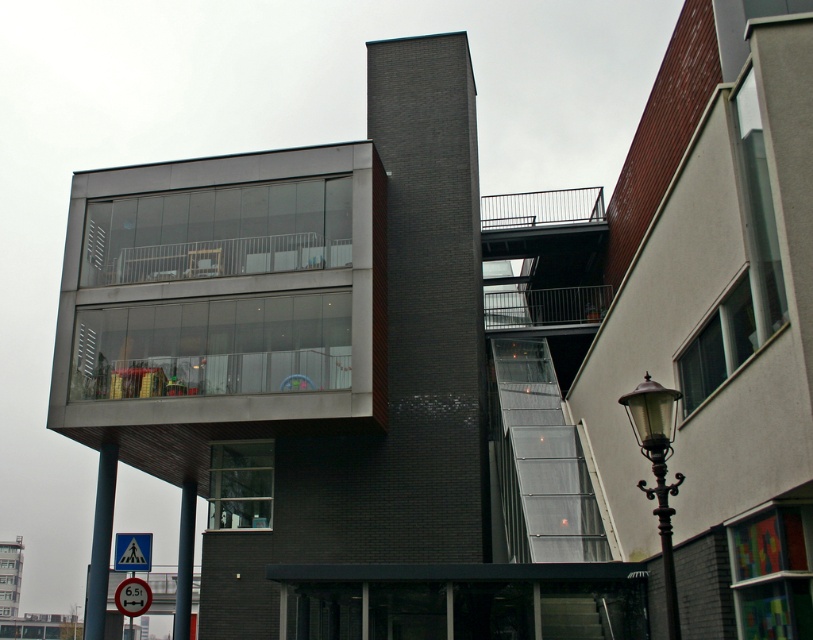
Question: Is black wrought iron streetlight at lower right behind red plastic speed limit sign at lower left?

Choices:
 (A) yes
 (B) no

Answer: (B)

Question: Which object appears closest to the camera in this image?

Choices:
 (A) metallic gray balcony at upper center
 (B) red plastic speed limit sign at lower left

Answer: (B)

Question: Does metallic gray balcony at upper center appear on the left side of red plastic speed limit sign at lower left?

Choices:
 (A) no
 (B) yes

Answer: (A)

Question: Which point is closer to the camera?

Choices:
 (A) (568, 291)
 (B) (146, 570)
 (C) (127, 612)

Answer: (C)

Question: From the image, what is the correct spatial relationship of metallic gray balcony at upper center in relation to yellow plastic triangle at lower left?

Choices:
 (A) right
 (B) left

Answer: (A)

Question: Which point appears farthest from the camera in this image?

Choices:
 (A) (672, 483)
 (B) (148, 586)

Answer: (B)